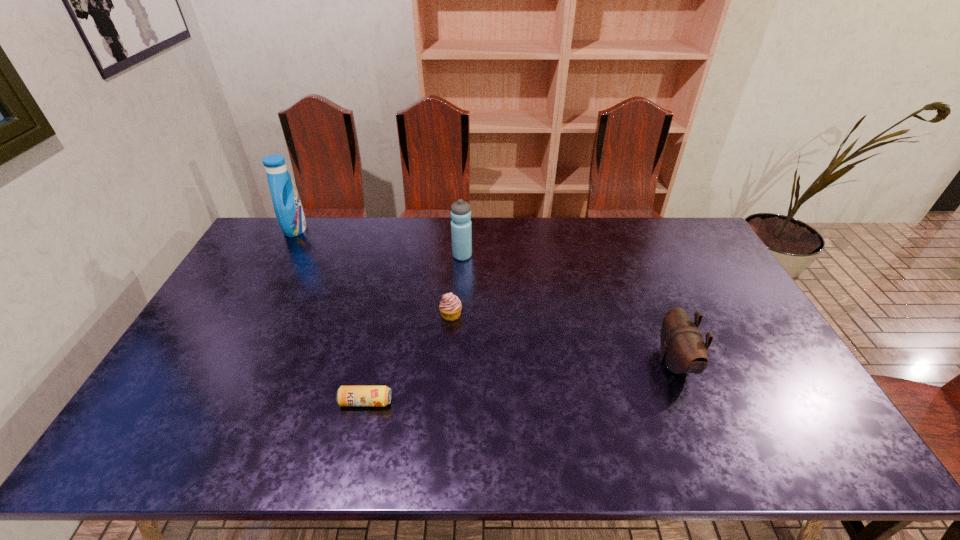
Image resolution: width=960 pixels, height=540 pixels. I want to click on vacant area between the cupcake and the tallest object, so tap(373, 272).

This screenshot has width=960, height=540. What are the coordinates of `free spot between the fourth tallest object and the water bottle` in the screenshot? It's located at (457, 285).

The width and height of the screenshot is (960, 540). Find the location of `free space between the water bottle and the second object from left to right`. free space between the water bottle and the second object from left to right is located at coordinates (414, 329).

What are the coordinates of `free space between the leftmost object and the second object from left to right` in the screenshot? It's located at (330, 315).

The image size is (960, 540). I want to click on vacant area that lies between the fourth nearest object and the second shortest object, so pyautogui.click(x=457, y=285).

At what (x,y) coordinates should I click in order to perform the action: click on free space between the fourth tallest object and the leftmost object. Please return your answer as a coordinate pair (x, y). Looking at the image, I should click on (373, 272).

Locate an element on the screen. object that stands as the third closest to the third farthest object is located at coordinates (683, 350).

Locate which object ranks fourth in proximity to the second object from left to right. Please provide its 2D coordinates. Your answer should be formatted as a tuple, i.e. [(x, y)], where the tuple contains the x and y coordinates of a point satisfying the conditions above.

[(287, 205)]

I want to click on free space that satisfies the following two spatial constraints: 1. on the front-facing side of the cupcake; 2. on the left side of the tallest object, so pyautogui.click(x=248, y=315).

Identify the location of free spot that satisfies the following two spatial constraints: 1. on the back side of the shortest object; 2. on the left side of the second shortest object. (386, 315).